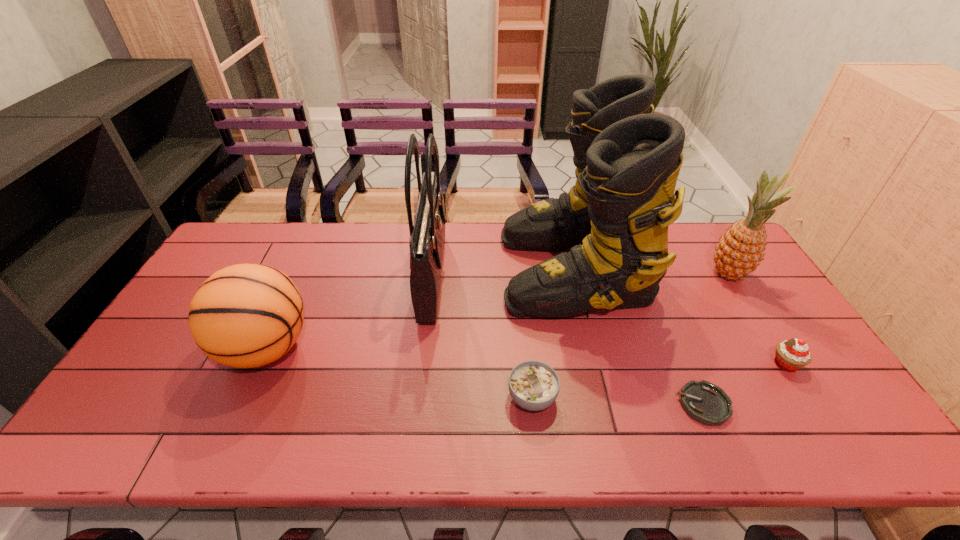
I want to click on free space at the near right corner of the desktop, so click(x=855, y=442).

In order to click on free space between the sixth object from right to left and the cupcake in this screenshot , I will do `click(609, 319)`.

Where is `free space between the ashtray and the leftmost object`? This screenshot has height=540, width=960. free space between the ashtray and the leftmost object is located at coordinates (485, 376).

At what (x,y) coordinates should I click in order to perform the action: click on empty location between the cupcake and the ski boots. Please return your answer as a coordinate pair (x, y). Looking at the image, I should click on (680, 317).

The image size is (960, 540). In order to click on free space between the basketball and the second shortest object in this screenshot , I will do `click(399, 373)`.

In order to click on free point between the fifth tallest object and the second shortest object in this screenshot , I will do `click(659, 381)`.

Find the location of `empty space that is in between the third shortest object and the second tallest object`. empty space that is in between the third shortest object and the second tallest object is located at coordinates (609, 319).

Where is `free spot between the sixth tallest object and the tallest object`? This screenshot has height=540, width=960. free spot between the sixth tallest object and the tallest object is located at coordinates (x=553, y=334).

You are a GUI agent. You are given a task and a screenshot of the screen. Output one action in this format:
    pyautogui.click(x=<x>, y=<y>)
    Task: Click on the object that stands as the fourth closest to the second object from left to right
    
    Given the screenshot: What is the action you would take?
    pyautogui.click(x=706, y=403)

Locate an element on the screen. object that can be found as the second closest to the cupcake is located at coordinates (616, 216).